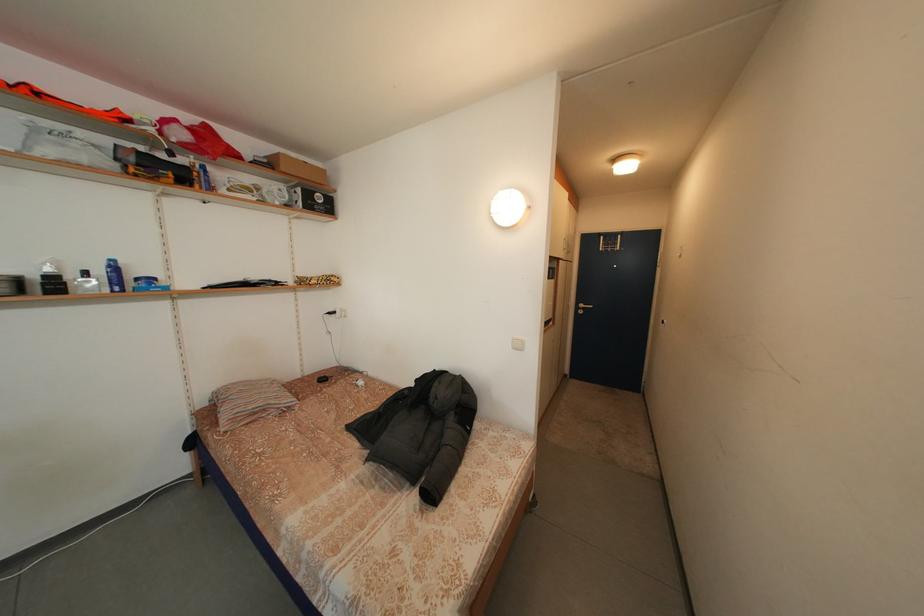
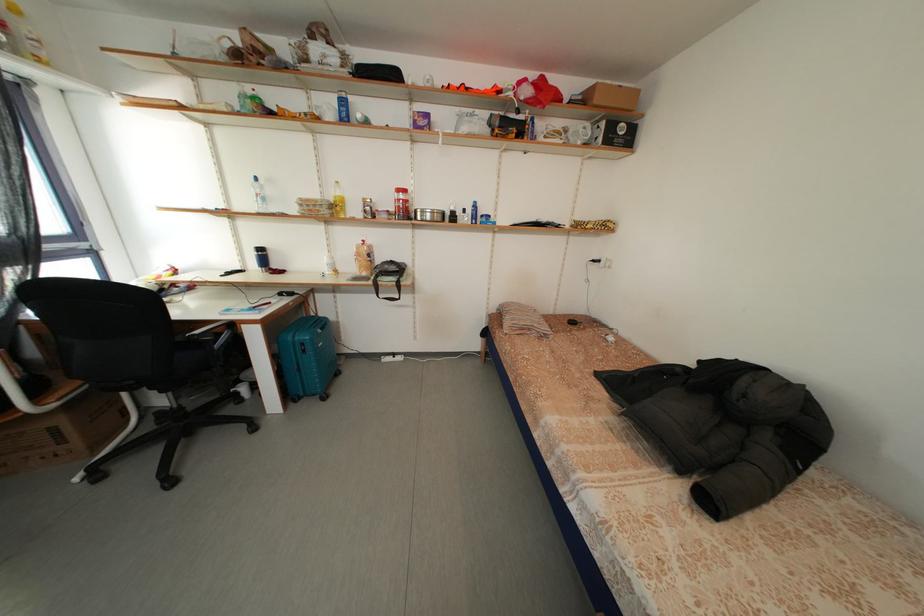
Question: The images are taken continuously from a first-person perspective. In which direction is your viewpoint rotating?

Choices:
 (A) Left
 (B) Right
 (C) Up
 (D) Down

Answer: (A)